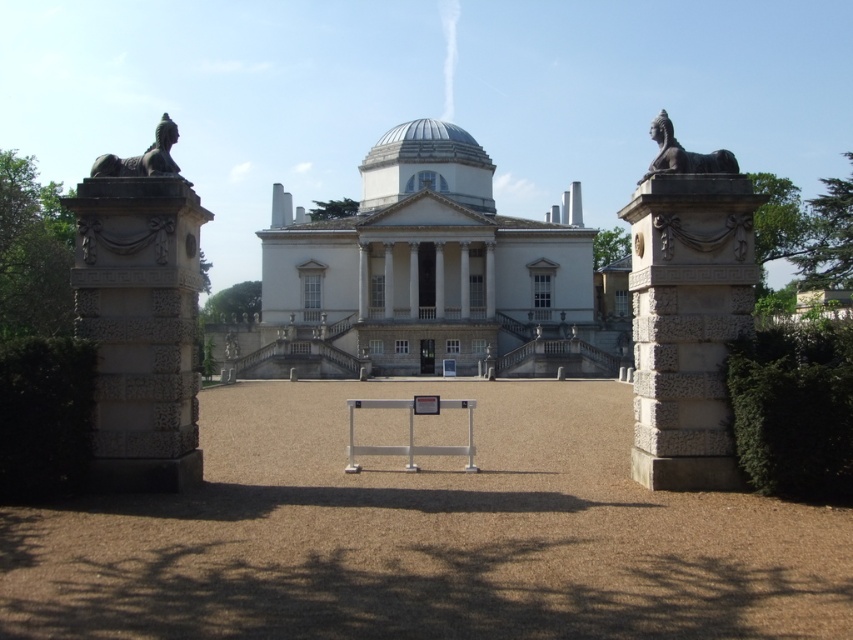
Based on the photo, does white marble mansion at center have a lesser width compared to white glossy dome at center?

In fact, white marble mansion at center might be wider than white glossy dome at center.

Is point (274, 272) positioned before point (370, 180)?

That is True.

Find the location of a particular element. white marble mansion at center is located at coordinates (422, 275).

The width and height of the screenshot is (853, 640). Find the location of `white marble mansion at center`. white marble mansion at center is located at coordinates (422, 275).

Looking at this image, between white marble mansion at center and marble statue at right, which one is positioned higher?

white marble mansion at center is above.

Between white marble mansion at center and marble statue at right, which one has less height?

With less height is marble statue at right.

Does point (296, 300) lie in front of point (701, 356)?

No.

Locate an element on the screen. The height and width of the screenshot is (640, 853). white marble mansion at center is located at coordinates (422, 275).

Does bronze statue at right appear under bronze statue at left?

Actually, bronze statue at right is above bronze statue at left.

Describe the element at coordinates (683, 154) in the screenshot. The width and height of the screenshot is (853, 640). I see `bronze statue at right` at that location.

Which is behind, point (654, 163) or point (160, 168)?

Point (654, 163)

Image resolution: width=853 pixels, height=640 pixels. Identify the location of bronze statue at right. (683, 154).